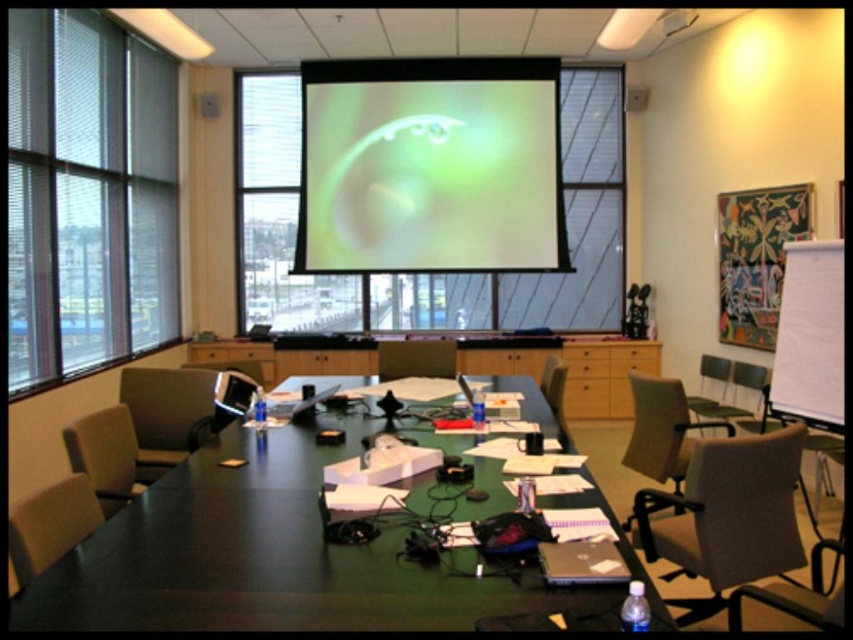
You are organizing a meeting in the conference room and need to place a large rectangular box on the table. The box is as big as the beige fabric chair at right. Will it fit on the black glossy table at center?

The black glossy table at center has a larger size compared to beige fabric chair at right, so the box will fit on the black glossy table at center since it is bigger than the chair.

You are organizing a meeting in the conference room and need to place a large poster on the wall. The poster requires a clear, unobstructed space. Which object between the transparent glass window at left and the matte gray chair at left should you avoid placing the poster near?

You should avoid placing the poster near the transparent glass window at left because it has a larger size compared to the matte gray chair at left, which means it occupies more space and may block the poster.

You are sitting in the beige fabric chair at right and want to reach the black glossy table at center to grab a pen. Is the table within your immediate reach without moving from your seat?

The black glossy table at center is in front of the beige fabric chair at right, so it should be within immediate reach from your current position.